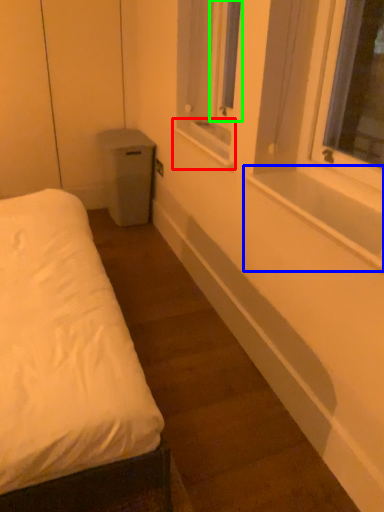
Question: Which object is the farthest from window sill (highlighted by a red box)? Choose among these: window sill (highlighted by a blue box) or window screen (highlighted by a green box).

Choices:
 (A) window sill
 (B) window screen

Answer: (A)